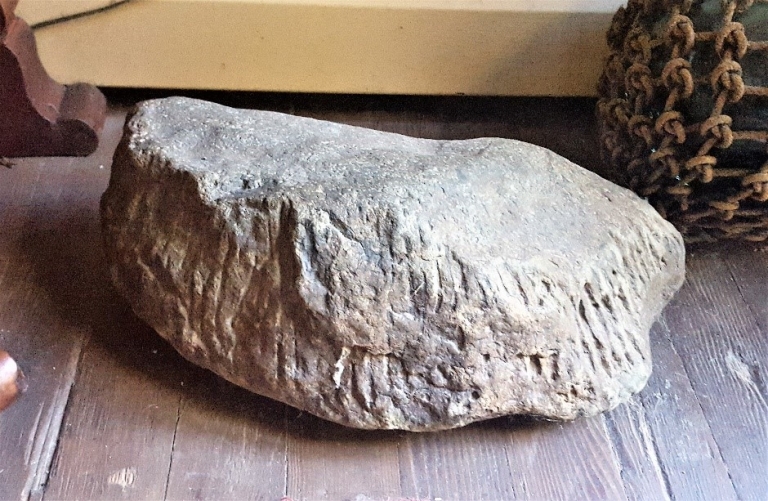
The image size is (768, 501). Identify the location of molding. (469, 57).